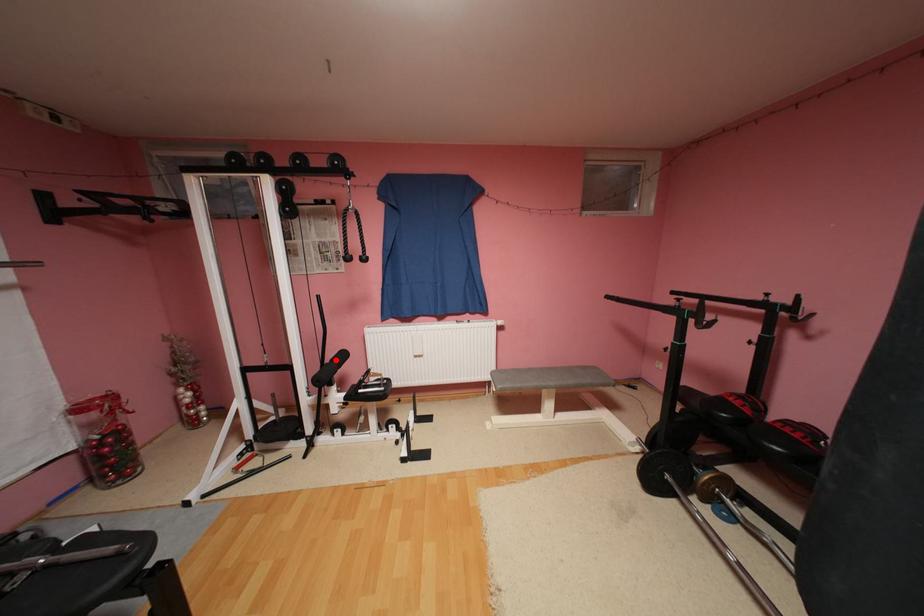
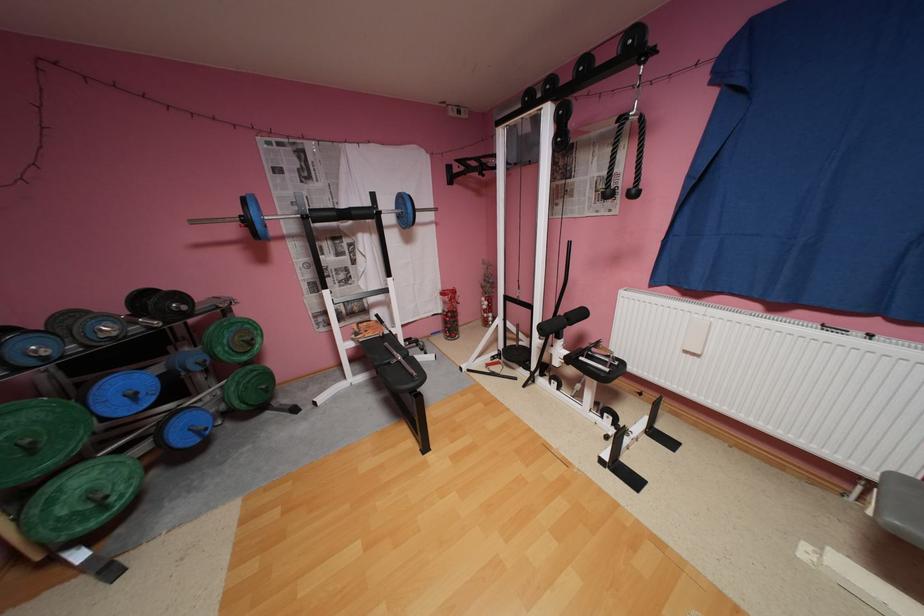
Where in the second image is the point corresponding to the highlighted location from the first image?

(570, 312)